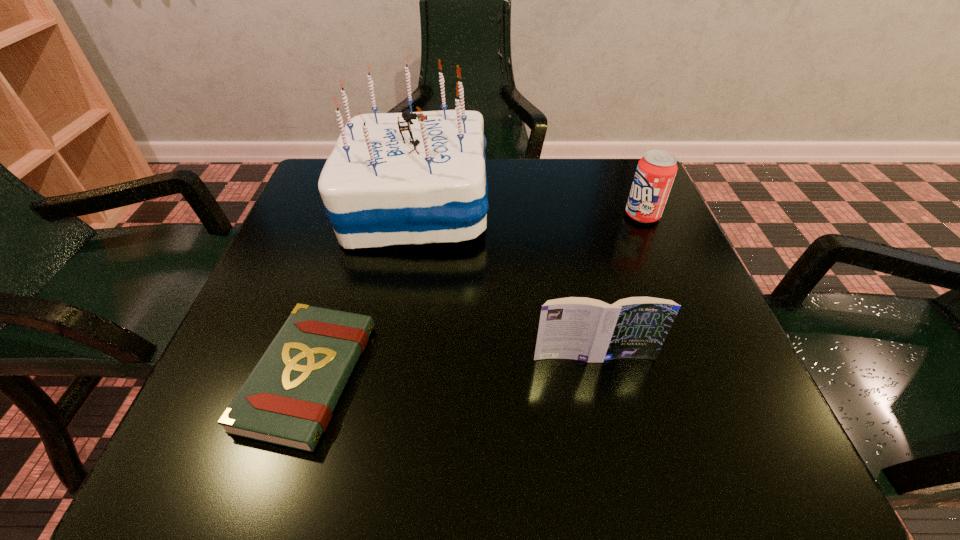
Locate an element on the screen. The height and width of the screenshot is (540, 960). vacant space situated on the front cover of the right book is located at coordinates (618, 470).

The width and height of the screenshot is (960, 540). Find the location of `vacant region located on the left of the shorter book`. vacant region located on the left of the shorter book is located at coordinates (219, 376).

Where is `birthday cake situated at the far edge`? This screenshot has height=540, width=960. birthday cake situated at the far edge is located at coordinates (404, 178).

The width and height of the screenshot is (960, 540). I want to click on soda can positioned at the far edge, so click(x=656, y=170).

The image size is (960, 540). I want to click on object that is at the near edge, so click(288, 399).

Identify the location of birthday cake at the left edge. (404, 178).

At what (x,y) coordinates should I click in order to perform the action: click on book that is at the left edge. Please return your answer as a coordinate pair (x, y). Looking at the image, I should click on (288, 399).

Locate an element on the screen. soda can that is at the right edge is located at coordinates (656, 170).

Where is `book positioned at the right edge`? This screenshot has height=540, width=960. book positioned at the right edge is located at coordinates (579, 328).

Find the location of a particular element. The height and width of the screenshot is (540, 960). object that is at the far left corner is located at coordinates (404, 178).